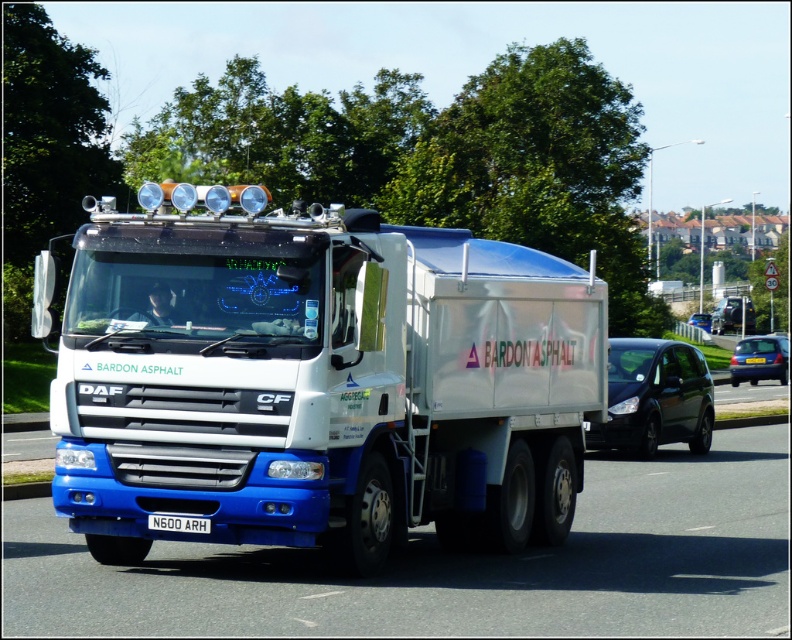
Is the position of blue metallic hatchback at right less distant than that of white metallic license plate at center?

No, it is not.

Can you confirm if blue metallic hatchback at right is shorter than white metallic license plate at center?

Incorrect, blue metallic hatchback at right's height does not fall short of white metallic license plate at center's.

Which is behind, point (756, 378) or point (200, 525)?

Positioned behind is point (756, 378).

The image size is (792, 640). I want to click on blue metallic hatchback at right, so click(x=760, y=358).

Is white glossy truck at center bigger than black matte van at right?

No, white glossy truck at center is not bigger than black matte van at right.

Is white glossy truck at center further to camera compared to black matte van at right?

No, white glossy truck at center is in front of black matte van at right.

Who is more forward, (307,205) or (665,387)?

Point (307,205)

Find the location of a particular element. white glossy truck at center is located at coordinates (318, 380).

Can you confirm if blue metallic hatchback at right is thinner than blue metallic van at center?

Yes.

In the scene shown: Can you confirm if blue metallic hatchback at right is positioned to the left of blue metallic van at center?

Correct, you'll find blue metallic hatchback at right to the left of blue metallic van at center.

Which is behind, point (752, 365) or point (707, 317)?

The point (707, 317) is more distant.

Find the location of a particular element. Image resolution: width=792 pixels, height=640 pixels. blue metallic hatchback at right is located at coordinates (760, 358).